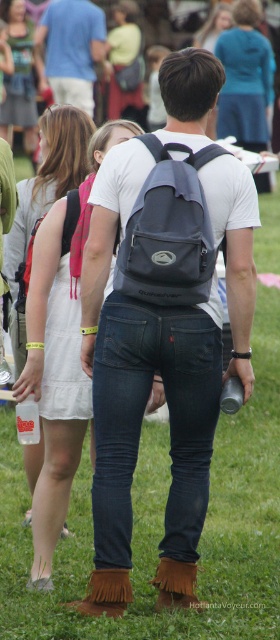
Can you confirm if matte blue backpack at center is bigger than matte black backpack at upper center?

No, matte blue backpack at center is not bigger than matte black backpack at upper center.

This screenshot has height=640, width=280. I want to click on matte blue backpack at center, so click(x=169, y=230).

Who is more distant from viewer, (117, 454) or (245, 112)?

Positioned behind is point (245, 112).

Is dark blue denim jeans at center taller than blue denim jacket at upper center?

No, dark blue denim jeans at center is not taller than blue denim jacket at upper center.

What do you see at coordinates (141, 419) in the screenshot?
I see `dark blue denim jeans at center` at bounding box center [141, 419].

Where is `dark blue denim jeans at center`? The height and width of the screenshot is (640, 280). dark blue denim jeans at center is located at coordinates (141, 419).

Does matte black backpack at center have a greater height compared to dark blue denim jeans at center?

Yes.

The height and width of the screenshot is (640, 280). Find the location of `matte black backpack at center`. matte black backpack at center is located at coordinates (164, 323).